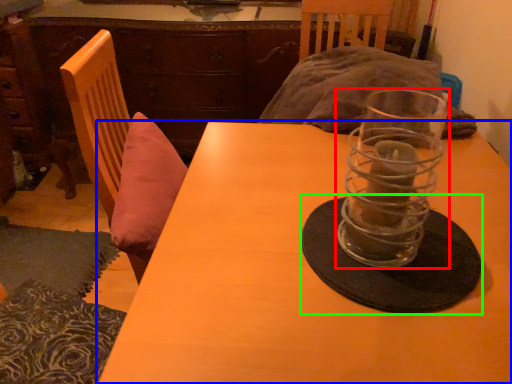
Question: Estimate the real-world distances between objects in this image. Which object is closer to tableware (highlighted by a red box), table (highlighted by a blue box) or glass plate (highlighted by a green box)?

Choices:
 (A) table
 (B) glass plate

Answer: (B)